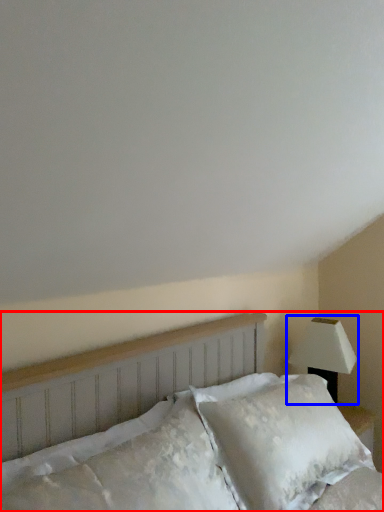
Question: Among these objects, which one is farthest to the camera, bed (highlighted by a red box) or lamp (highlighted by a blue box)?

Choices:
 (A) bed
 (B) lamp

Answer: (B)